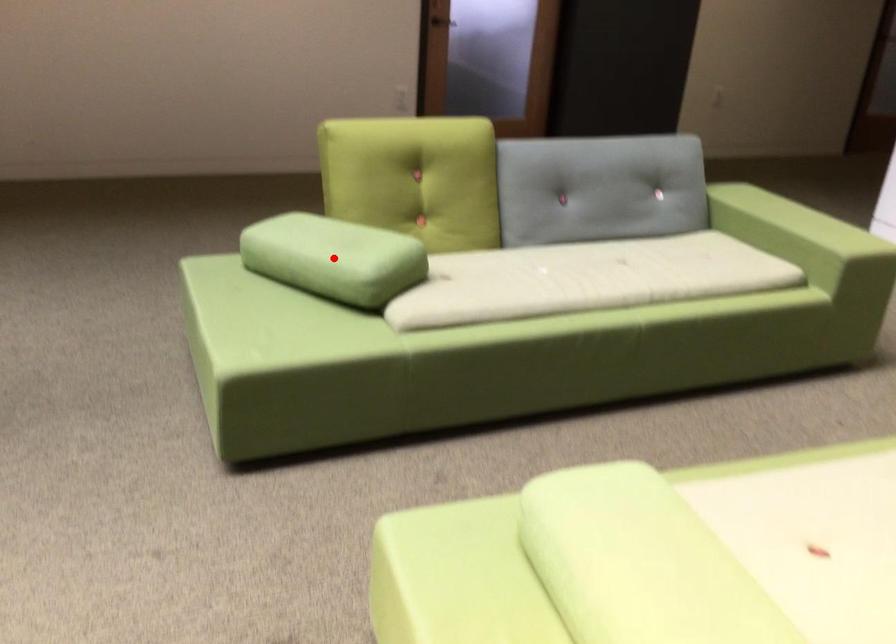
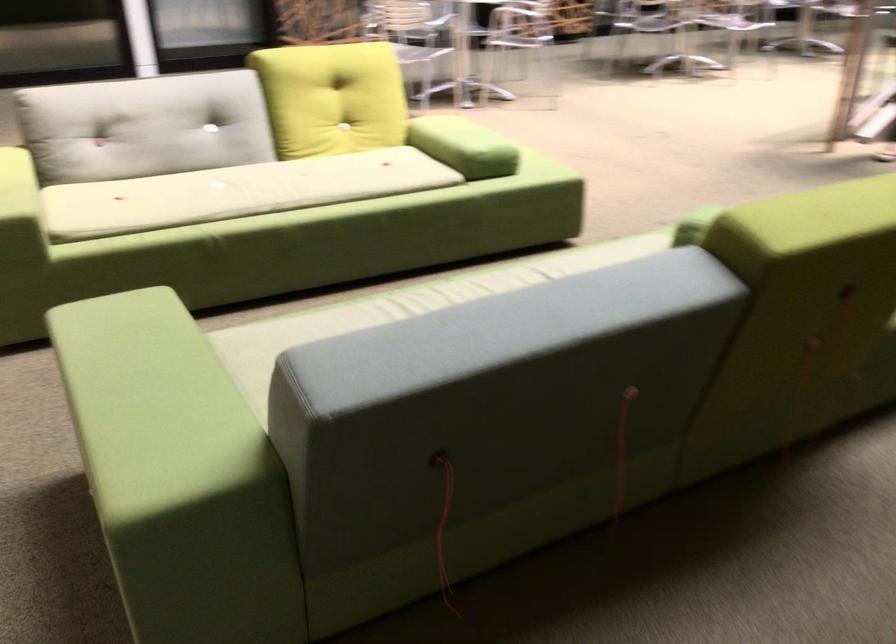
Question: I am providing you with two images of the same scene from different viewpoints. A red point is marked on the first image. Is the red point's position out of view in image 2?

Choices:
 (A) Yes
 (B) No

Answer: (A)